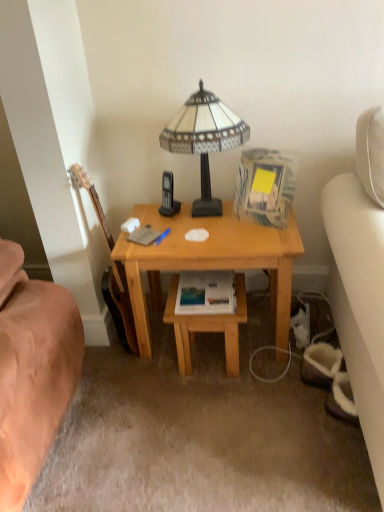
Where is `vacant space to the left of stained glass lampshade at center`? The height and width of the screenshot is (512, 384). vacant space to the left of stained glass lampshade at center is located at coordinates (152, 222).